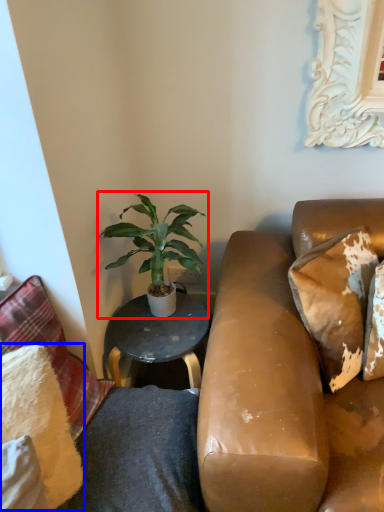
Question: Which point is closer to the camera, houseplant (highlighted by a red box) or pillow (highlighted by a blue box)?

Choices:
 (A) houseplant
 (B) pillow

Answer: (B)